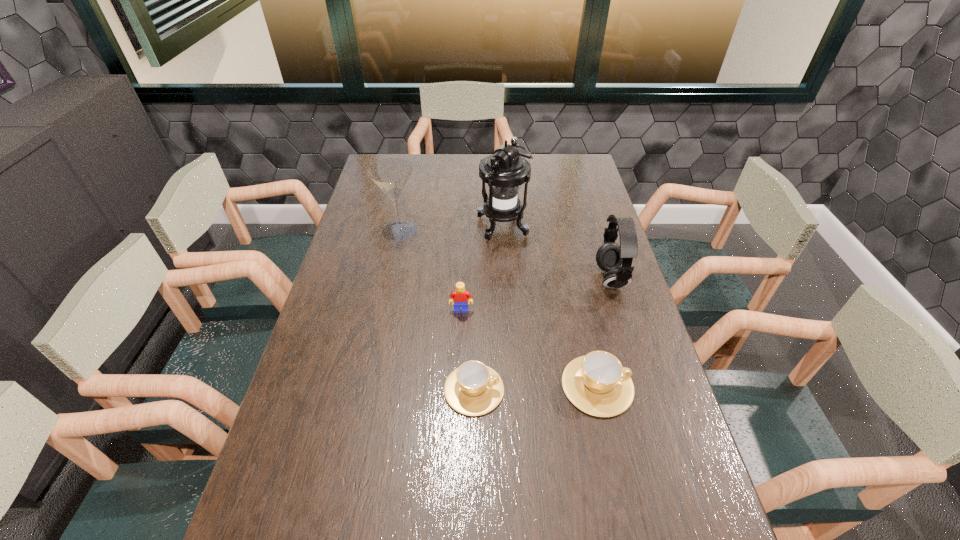
This screenshot has height=540, width=960. Identify the location of empty space that is in between the tallest object and the Lego. (482, 268).

Locate an element on the screen. The height and width of the screenshot is (540, 960). free space between the shortest object and the earphone is located at coordinates (542, 334).

Find the location of a particular element. The width and height of the screenshot is (960, 540). free space that is in between the Lego and the shortest object is located at coordinates (468, 350).

The height and width of the screenshot is (540, 960). I want to click on empty location between the leftmost object and the tallest object, so click(x=451, y=228).

Where is `vacant space that is in between the taller cup and the tallest object`? This screenshot has height=540, width=960. vacant space that is in between the taller cup and the tallest object is located at coordinates (550, 306).

Locate which object is the closest to the Lego. Please provide its 2D coordinates. Your answer should be formatted as a tuple, i.e. [(x, y)], where the tuple contains the x and y coordinates of a point satisfying the conditions above.

[(473, 389)]

You are a GUI agent. You are given a task and a screenshot of the screen. Output one action in this format:
    pyautogui.click(x=<x>, y=<y>)
    Task: Click on the second closest object to the right cup
    The height and width of the screenshot is (540, 960).
    Given the screenshot: What is the action you would take?
    pyautogui.click(x=610, y=256)